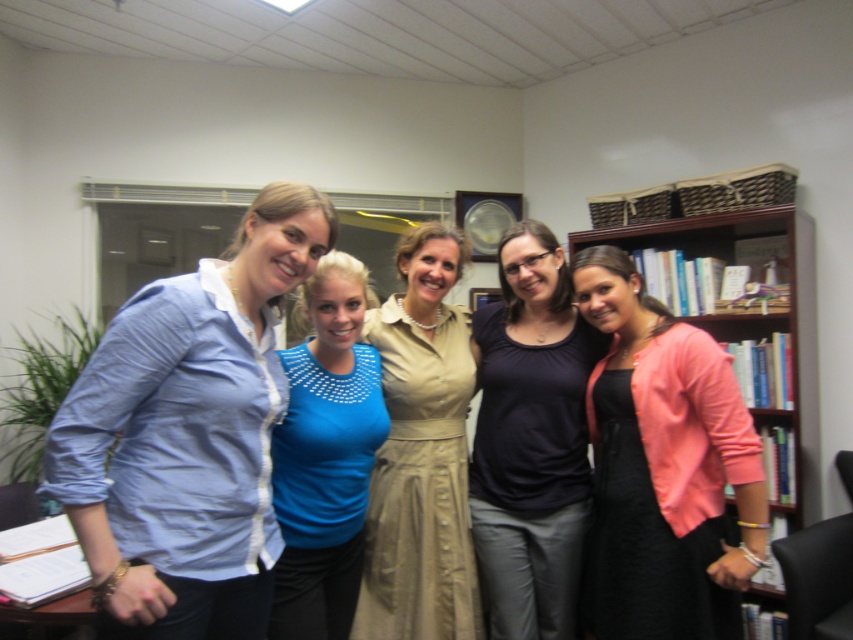
Which is in front, point (531, 576) or point (407, 376)?

Positioned in front is point (407, 376).

Where is `matte black blouse at center`? The height and width of the screenshot is (640, 853). matte black blouse at center is located at coordinates tap(531, 440).

Is matte black blouse at center further to camera compared to blue jersey at center?

That is True.

The width and height of the screenshot is (853, 640). What are the coordinates of `matte black blouse at center` in the screenshot? It's located at (531, 440).

Find the location of a particular element. The width and height of the screenshot is (853, 640). light blue shirt at left is located at coordinates (189, 435).

Is light blue shirt at left positioned at the back of matte black blouse at center?

No, light blue shirt at left is closer to the viewer.

Which is behind, point (268, 381) or point (550, 404)?

The point (550, 404) is behind.

Locate an element on the screen. light blue shirt at left is located at coordinates (189, 435).